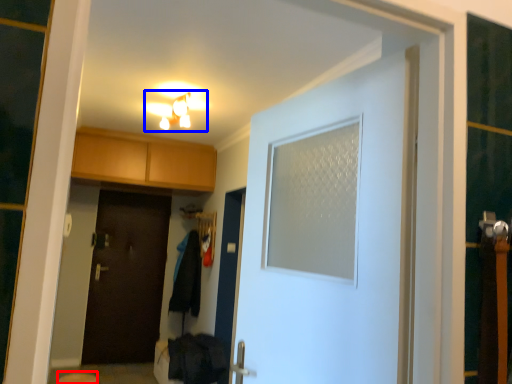
Question: Among these objects, which one is nearest to the camera, step stool (highlighted by a red box) or light fixture (highlighted by a blue box)?

Choices:
 (A) step stool
 (B) light fixture

Answer: (A)